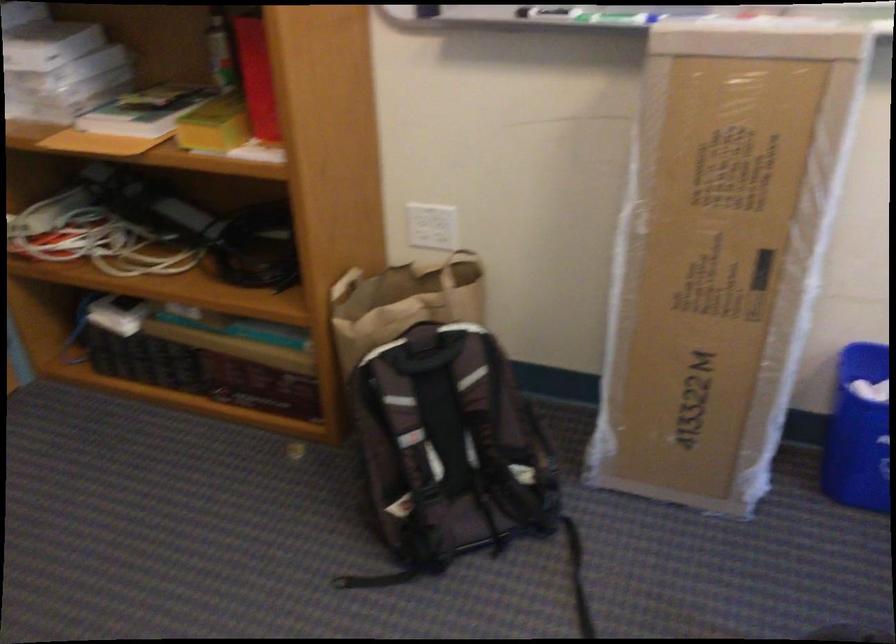
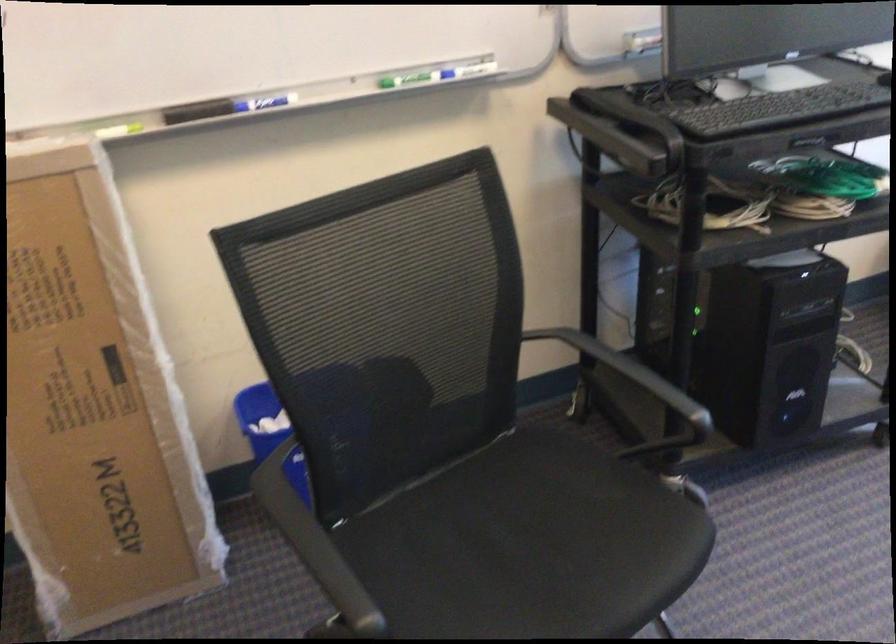
Question: The camera is either moving clockwise (left) or counter-clockwise (right) around the object. The first image is from the beginning of the video and the second image is from the end. Is the camera moving left or right when shooting the video?

Choices:
 (A) Left
 (B) Right

Answer: (A)